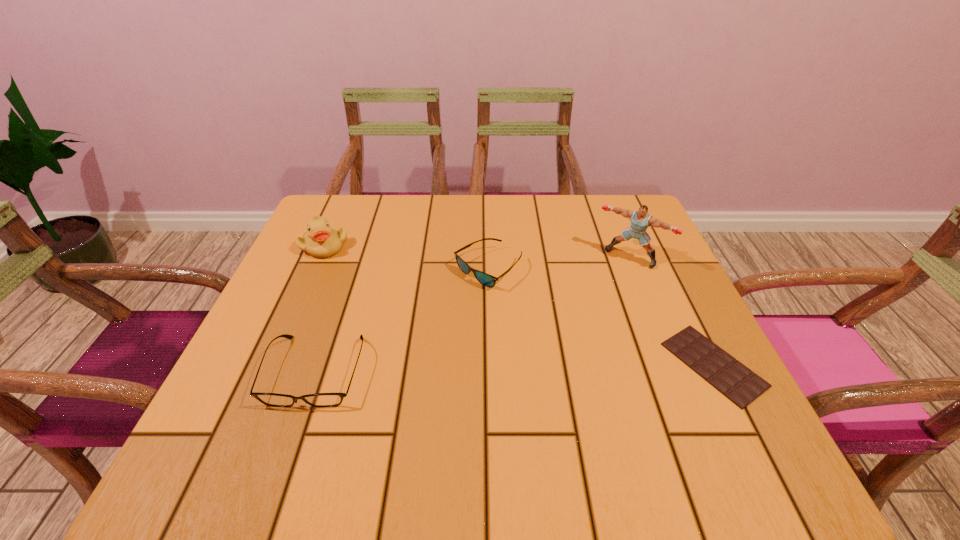
The width and height of the screenshot is (960, 540). I want to click on vacant space on the desktop that is between the spectacles and the shortest object and is positioned at the front of the sunglasses showing the lenses, so click(x=468, y=368).

In order to click on free spot on the desktop that is between the spectacles and the shortest object and is positioned on the front-facing side of the duckling in this screenshot , I will do `click(475, 368)`.

I want to click on vacant space on the desktop that is between the spectacles and the shortest object and is positioned on the front-facing side of the tallest object, so click(x=552, y=367).